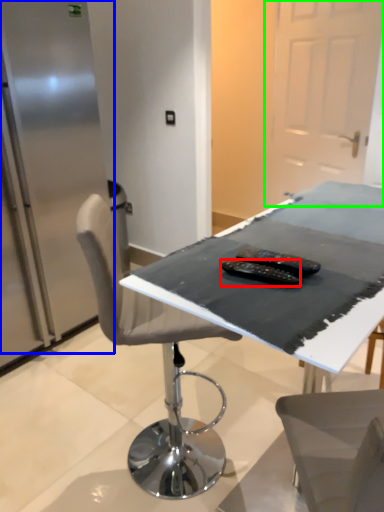
Question: Which object is positioned farthest from equipment (highlighted by a red box)? Select from fridge (highlighted by a blue box) and glass door (highlighted by a green box).

Choices:
 (A) fridge
 (B) glass door

Answer: (B)